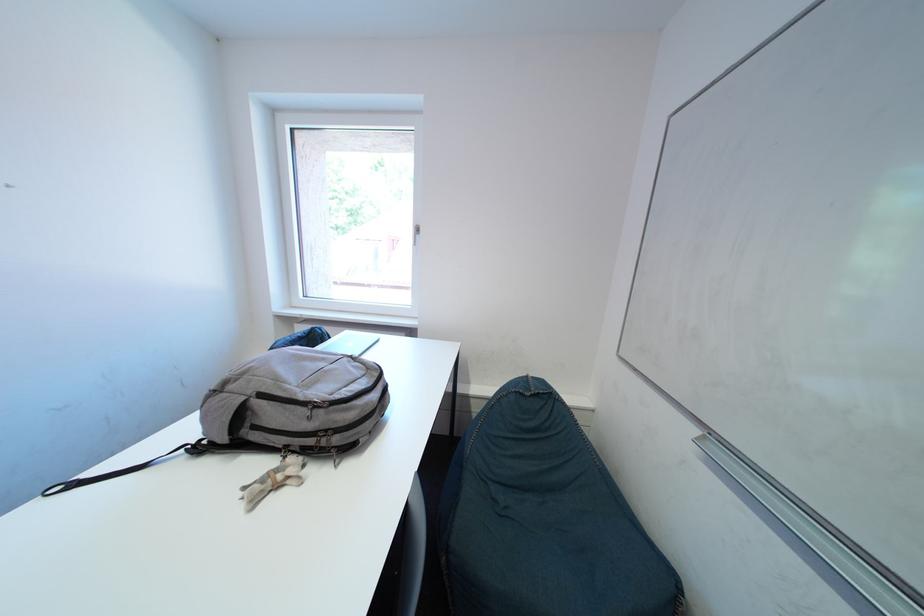
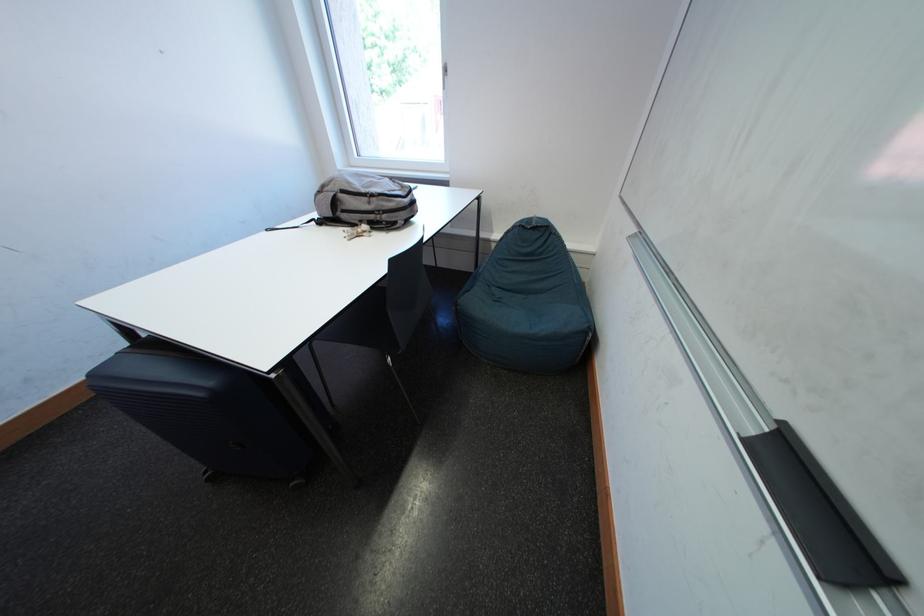
The point at (466, 416) is marked in the first image. Where is the corresponding point in the second image?

(490, 259)